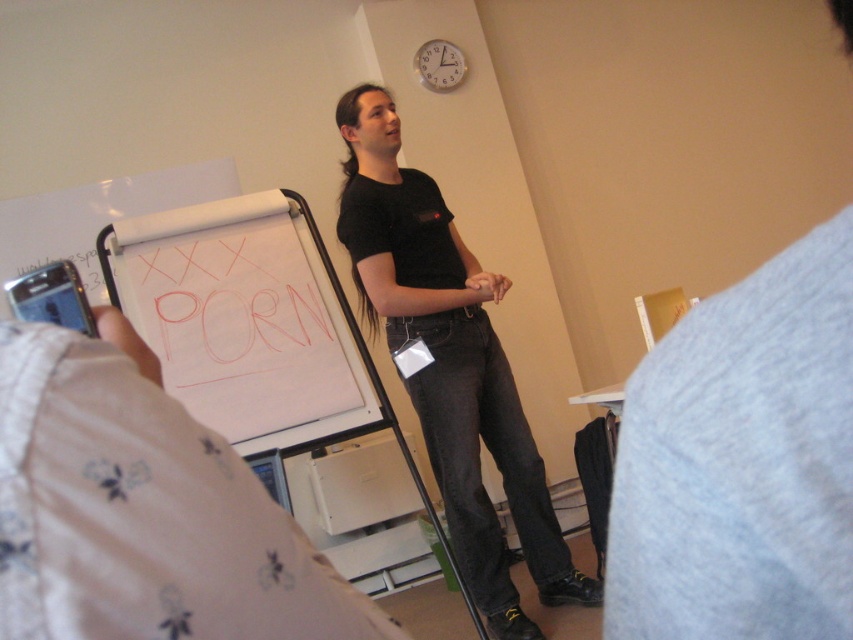
Describe the element at coordinates (450, 365) in the screenshot. I see `black matte shirt at center` at that location.

In the scene shown: Does black matte shirt at center have a smaller size compared to white paperboard at center?

Incorrect, black matte shirt at center is not smaller in size than white paperboard at center.

Does point (372, 330) come farther from viewer compared to point (378, 419)?

Yes.

This screenshot has height=640, width=853. What are the coordinates of `black matte shirt at center` in the screenshot? It's located at (450, 365).